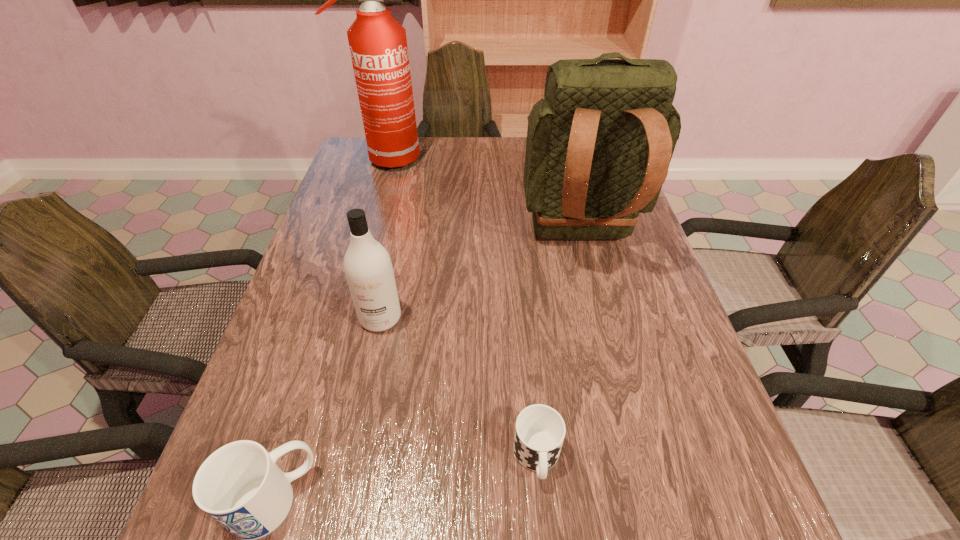
At what (x,y) coordinates should I click in order to perform the action: click on vacant region located 0.060m on the side of the shortest object with the handle. Please return your answer as a coordinate pair (x, y). The height and width of the screenshot is (540, 960). Looking at the image, I should click on (544, 531).

Locate an element on the screen. object that is at the far edge is located at coordinates (378, 45).

What are the coordinates of `object that is at the left edge` in the screenshot? It's located at (378, 45).

In order to click on object that is positioned at the right edge in this screenshot , I will do `click(599, 145)`.

The height and width of the screenshot is (540, 960). In order to click on object located at the far left corner in this screenshot , I will do `click(378, 45)`.

This screenshot has height=540, width=960. I want to click on free space at the far edge of the desktop, so click(x=495, y=158).

In the image, there is a desktop. Where is `vacant space at the near edge`? Image resolution: width=960 pixels, height=540 pixels. vacant space at the near edge is located at coordinates (647, 538).

In order to click on free spot at the left edge of the desktop in this screenshot , I will do [341, 245].

Locate an element on the screen. free space at the right edge is located at coordinates (651, 259).

The width and height of the screenshot is (960, 540). I want to click on free location at the far left corner, so click(x=354, y=146).